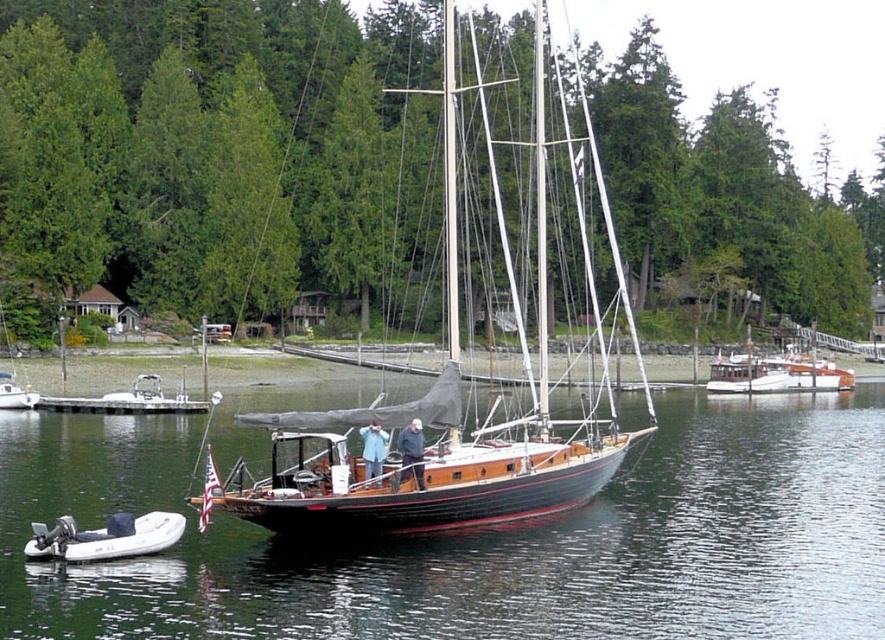
Question: Is green matte tree at center thinner than white rubber dinghy at lower left?

Choices:
 (A) yes
 (B) no

Answer: (B)

Question: Does wooden boat at center have a larger size compared to white rubber dinghy at lower left?

Choices:
 (A) no
 (B) yes

Answer: (B)

Question: Considering the real-world distances, which object is closest to the white rubber dinghy at lower left?

Choices:
 (A) wooden boat at center
 (B) wooden sailboat at center
 (C) green matte tree at center

Answer: (A)

Question: Which object is farther from the camera taking this photo?

Choices:
 (A) wooden sailboat at center
 (B) green matte tree at center
 (C) wooden boat at center

Answer: (B)

Question: Which of these objects is positioned farthest from the white rubber dinghy at lower left?

Choices:
 (A) wooden sailboat at center
 (B) green matte tree at center
 (C) wooden boat at center

Answer: (B)

Question: Observing the image, what is the correct spatial positioning of green matte tree at center in reference to wooden boat at center?

Choices:
 (A) left
 (B) right

Answer: (B)